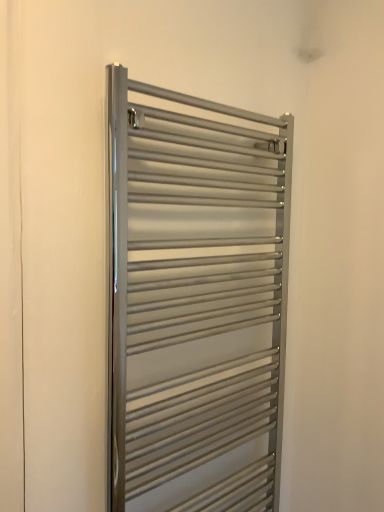
Find the location of a particular element. The image size is (384, 512). satin silver towel rack at center is located at coordinates (194, 302).

Image resolution: width=384 pixels, height=512 pixels. What do you see at coordinates (194, 302) in the screenshot?
I see `satin silver towel rack at center` at bounding box center [194, 302].

Find the location of a particular element. Image resolution: width=384 pixels, height=512 pixels. satin silver towel rack at center is located at coordinates (194, 302).